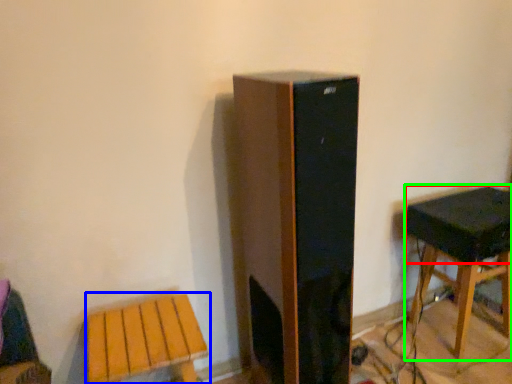
Question: Estimate the real-world distances between objects in this image. Which object is farther from speaker (highlighted by a red box), stool (highlighted by a blue box) or stool (highlighted by a green box)?

Choices:
 (A) stool
 (B) stool

Answer: (A)